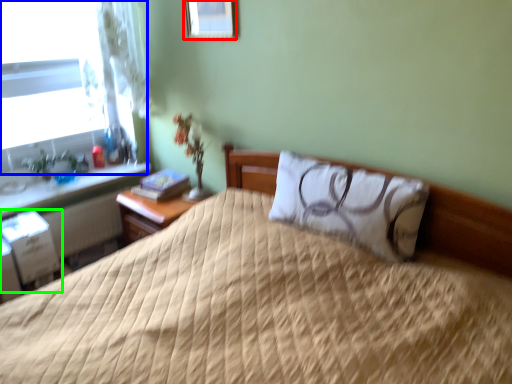
Question: Which object is the closest to the picture frame (highlighted by a red box)? Choose among these: window (highlighted by a blue box) or file cabinet (highlighted by a green box).

Choices:
 (A) window
 (B) file cabinet

Answer: (A)